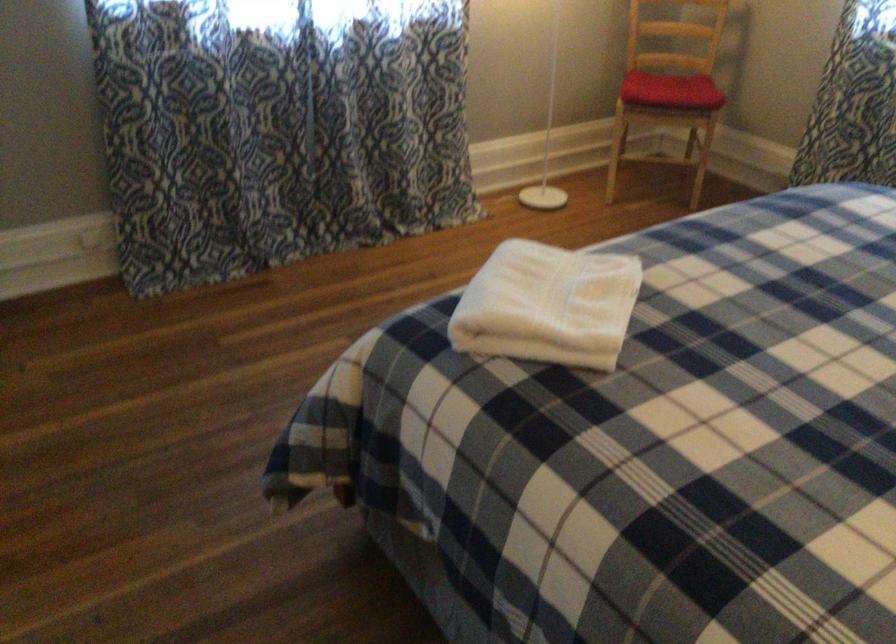
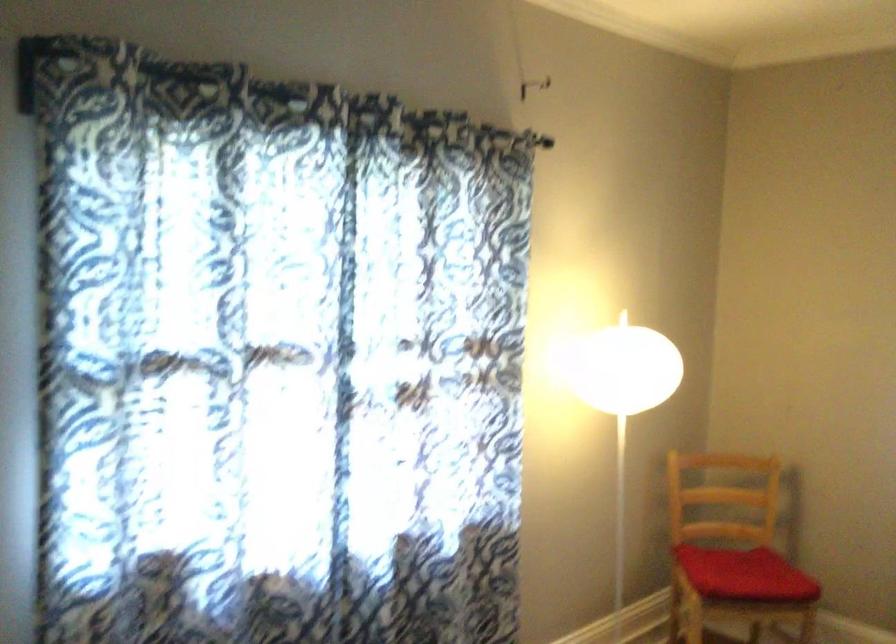
Where in the second image is the point corresponding to point (659, 84) from the first image?

(745, 574)